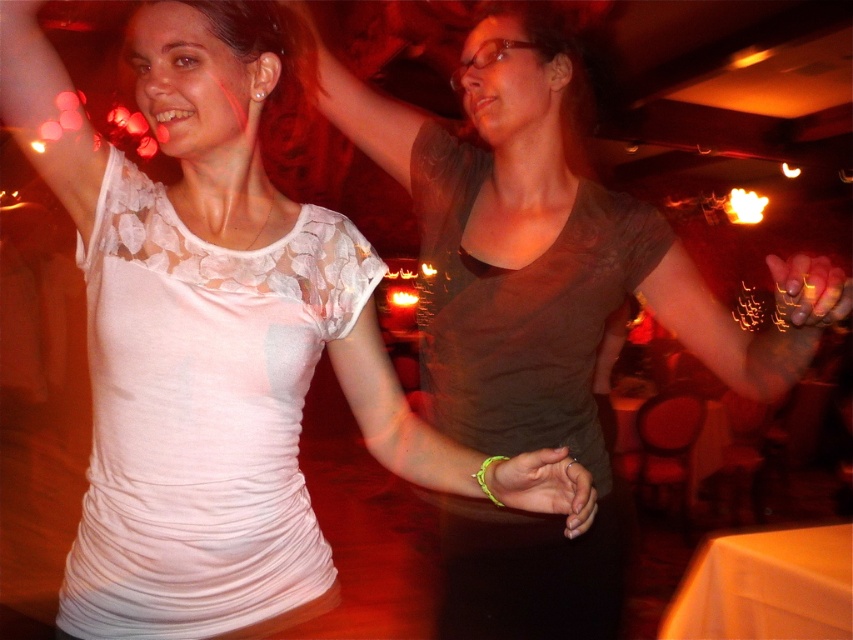
Which is more to the right, white lace top at upper left or shiny gold nail polish at upper right?

Positioned to the right is shiny gold nail polish at upper right.

You are a GUI agent. You are given a task and a screenshot of the screen. Output one action in this format:
    pyautogui.click(x=<x>, y=<y>)
    Task: Click on the white lace top at upper left
    The image size is (853, 640).
    Given the screenshot: What is the action you would take?
    pyautogui.click(x=206, y=337)

From the picture: Can you confirm if matte brown shirt at center is shorter than neon green wristband at center?

No, matte brown shirt at center is not shorter than neon green wristband at center.

Who is positioned more to the right, matte brown shirt at center or neon green wristband at center?

Positioned to the right is matte brown shirt at center.

Is point (540, 627) farther from viewer compared to point (573, 468)?

Yes, point (540, 627) is farther from viewer.

The width and height of the screenshot is (853, 640). Find the location of `matte brown shirt at center`. matte brown shirt at center is located at coordinates (532, 310).

Describe the element at coordinates (206, 337) in the screenshot. This screenshot has width=853, height=640. I see `white lace top at upper left` at that location.

Does point (184, 118) lie behind point (486, 417)?

No, (184, 118) is in front of (486, 417).

Is point (113, 289) behind point (608, 570)?

No, (113, 289) is in front of (608, 570).

Locate an element on the screen. white lace top at upper left is located at coordinates (206, 337).